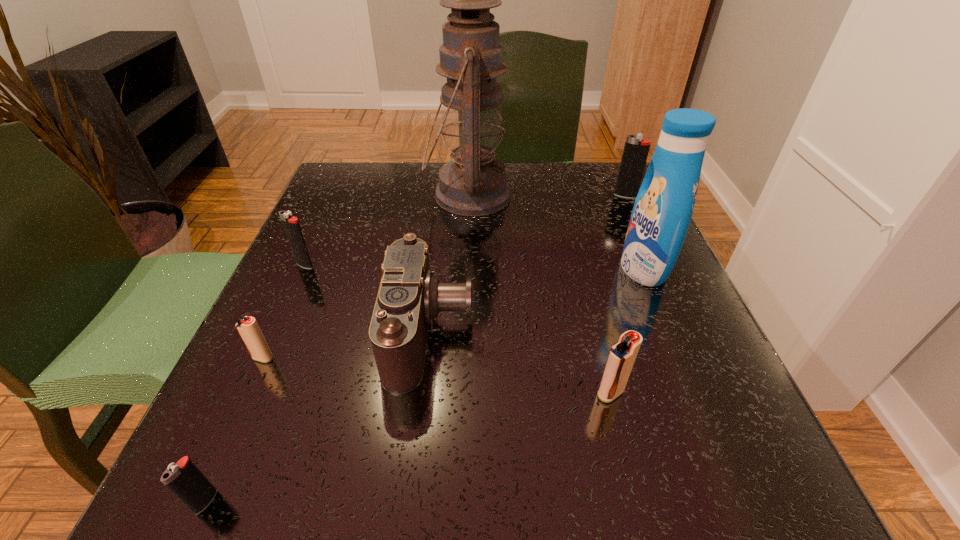
Find the location of a particular element. The image size is (960, 540). empty location between the rightmost igniter and the right red igniter is located at coordinates (618, 294).

This screenshot has width=960, height=540. I want to click on vacant area between the second igniter from right to left and the oil lamp, so click(x=540, y=294).

Find the location of a particular element. free space between the third object from right to left and the fourth nearest igniter is located at coordinates (458, 329).

Image resolution: width=960 pixels, height=540 pixels. In order to click on vacant area between the smallest black igniter and the oil lamp in this screenshot , I will do `click(337, 348)`.

At what (x,y) coordinates should I click in order to perform the action: click on free point between the farther red igniter and the bigger red igniter. Please return your answer as a coordinate pair (x, y). Image resolution: width=960 pixels, height=540 pixels. Looking at the image, I should click on (437, 375).

Identify the location of the second closest object to the second farthest black igniter. This screenshot has width=960, height=540. (248, 328).

Identify which object is the third nearest to the second biggest black igniter. Please provide its 2D coordinates. Your answer should be formatted as a tuple, i.e. [(x, y)], where the tuple contains the x and y coordinates of a point satisfying the conditions above.

[(473, 183)]

Find the location of a particular element. igniter identified as the closest to the second biggest black igniter is located at coordinates (248, 328).

Locate which igniter is the fourth closest to the camera. Please provide its 2D coordinates. Your answer should be formatted as a tuple, i.e. [(x, y)], where the tuple contains the x and y coordinates of a point satisfying the conditions above.

[(184, 479)]

Find the location of a particular element. The width and height of the screenshot is (960, 540). black igniter object that ranks as the closest to the seventh shortest object is located at coordinates (636, 149).